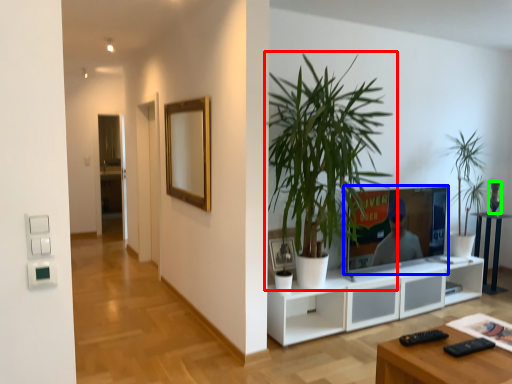
Question: Considering the real-world distances, which object is farthest from houseplant (highlighted by a red box)? television (highlighted by a blue box) or vase (highlighted by a green box)?

Choices:
 (A) television
 (B) vase

Answer: (B)